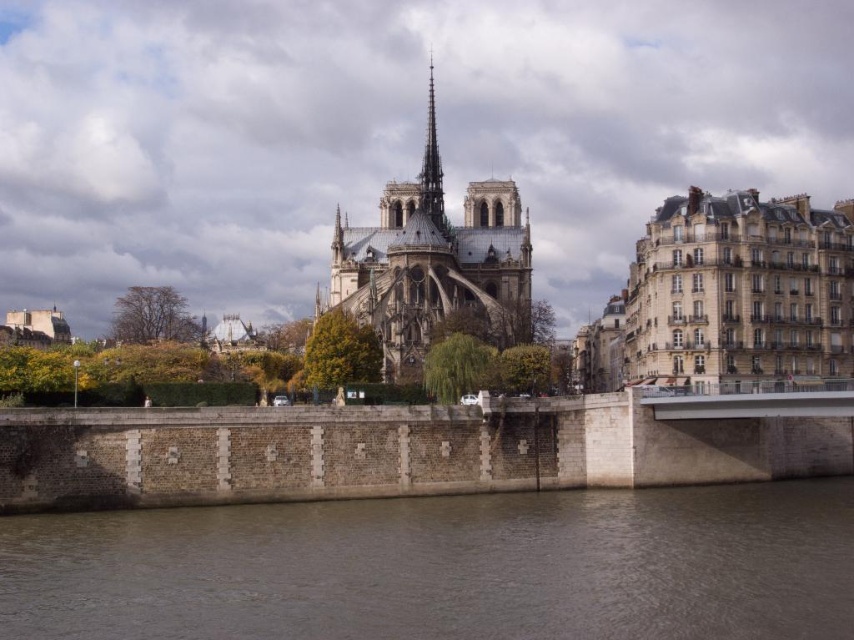
Based on the photo, you are standing at the point marked as point (445, 566) in the image. What object is directly in front of you?

The brown stone wall at lower center is located at point (445, 566), so the object directly in front of you is the brown stone wall at lower center.

You are an architect assessing the structural integrity of the scene. Given that the concrete bridge at center and the stone gothic cathedral at center are both critical to the area, which one has a greater width to accommodate more traffic?

The concrete bridge at center has a greater width than the stone gothic cathedral at center, so it can accommodate more traffic.

You are a tourist standing on the riverbank looking at the stone gothic cathedral at center and the brown stone wall at lower center. Which object is closer to the water surface?

The brown stone wall at lower center is closer to the water surface because it is positioned under the stone gothic cathedral at center.